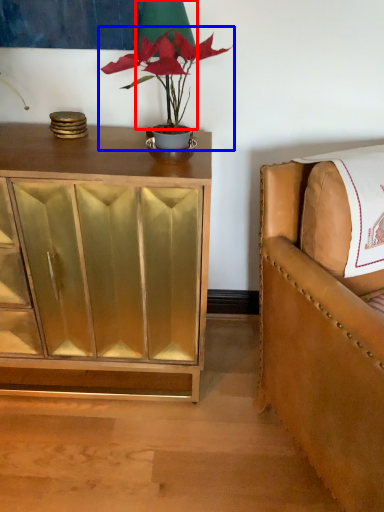
Question: Among these objects, which one is farthest to the camera, table lamp (highlighted by a red box) or houseplant (highlighted by a blue box)?

Choices:
 (A) table lamp
 (B) houseplant

Answer: (A)